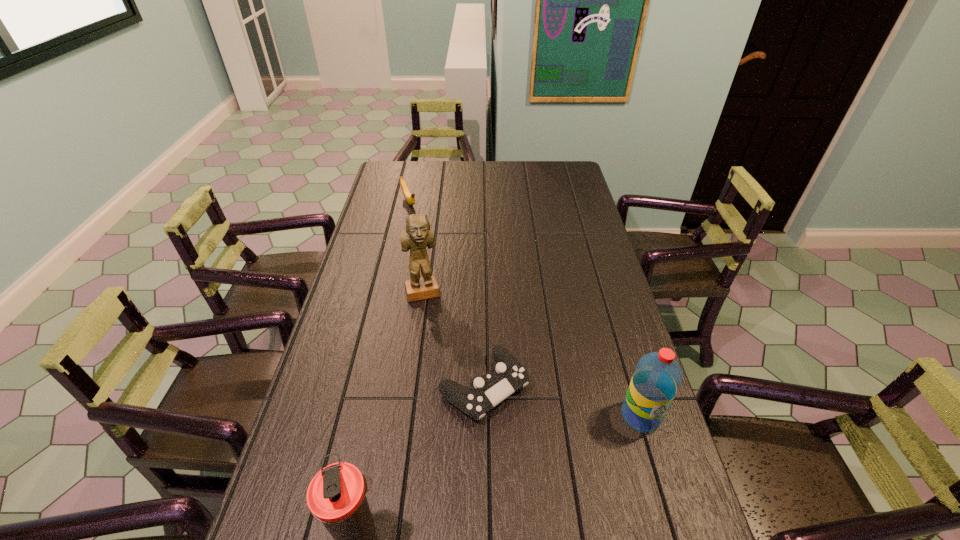
Where is `vacant space at the far right corner`? vacant space at the far right corner is located at coordinates (559, 183).

You are a GUI agent. You are given a task and a screenshot of the screen. Output one action in this format:
    pyautogui.click(x=<x>, y=<y>)
    Task: Click on the free spot between the banana and the rightmost object
    The width and height of the screenshot is (960, 540).
    Given the screenshot: What is the action you would take?
    pyautogui.click(x=525, y=309)

Identify the location of vacant area that lies between the second object from right to left and the farthest object. The height and width of the screenshot is (540, 960). (446, 294).

At what (x,y) coordinates should I click in order to perform the action: click on vacant area that lies between the control and the figurine. Please return your answer as a coordinate pair (x, y). Looking at the image, I should click on (453, 340).

Where is `blank region between the control and the banana`? blank region between the control and the banana is located at coordinates (446, 294).

Locate an element on the screen. vacant area that lies between the rightmost object and the fourth nearest object is located at coordinates (532, 354).

The height and width of the screenshot is (540, 960). In order to click on empty space that is in between the rightmost object and the fourth object from left to right in this screenshot , I will do `click(563, 401)`.

Where is `vacant area that lies between the second object from right to left and the farthest object`? The image size is (960, 540). vacant area that lies between the second object from right to left and the farthest object is located at coordinates (446, 294).

Identify which object is the second nearest to the water bottle. Please provide its 2D coordinates. Your answer should be formatted as a tuple, i.e. [(x, y)], where the tuple contains the x and y coordinates of a point satisfying the conditions above.

[(336, 496)]

Locate an element on the screen. This screenshot has height=540, width=960. object that stands as the third closest to the farthest object is located at coordinates (657, 377).